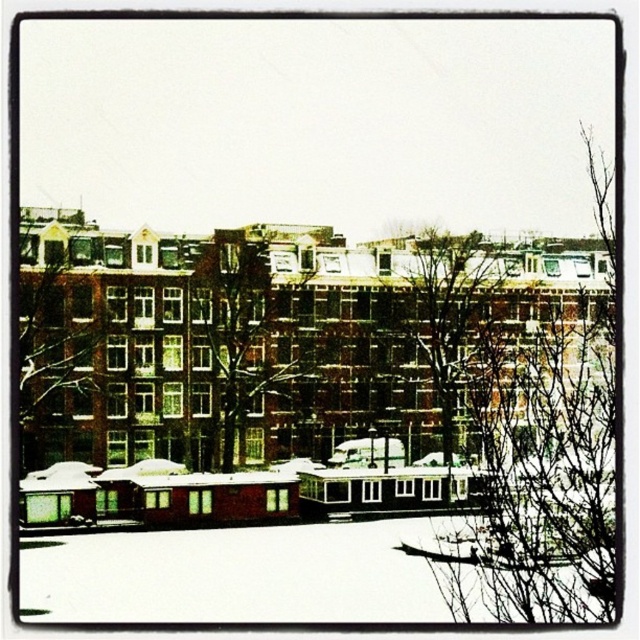
Question: Which of the following is the farthest from the observer?

Choices:
 (A) bare branches at center
 (B) bare branches at upper right
 (C) brown wooden tree at upper left
 (D) brown textured tree at center

Answer: (D)

Question: Is brown wooden tree at upper left closer to camera compared to bare branches at center?

Choices:
 (A) no
 (B) yes

Answer: (B)

Question: Is bare branches at upper right smaller than brown wooden tree at upper left?

Choices:
 (A) no
 (B) yes

Answer: (A)

Question: Which is nearer to the bare branches at upper right?

Choices:
 (A) brown textured tree at center
 (B) bare branches at center

Answer: (B)

Question: Where is brown wooden tree at upper left located in relation to bare branches at center in the image?

Choices:
 (A) below
 (B) above

Answer: (B)

Question: Among these objects, which one is farthest from the camera?

Choices:
 (A) bare branches at center
 (B) brown wooden tree at upper left
 (C) bare branches at upper right

Answer: (A)